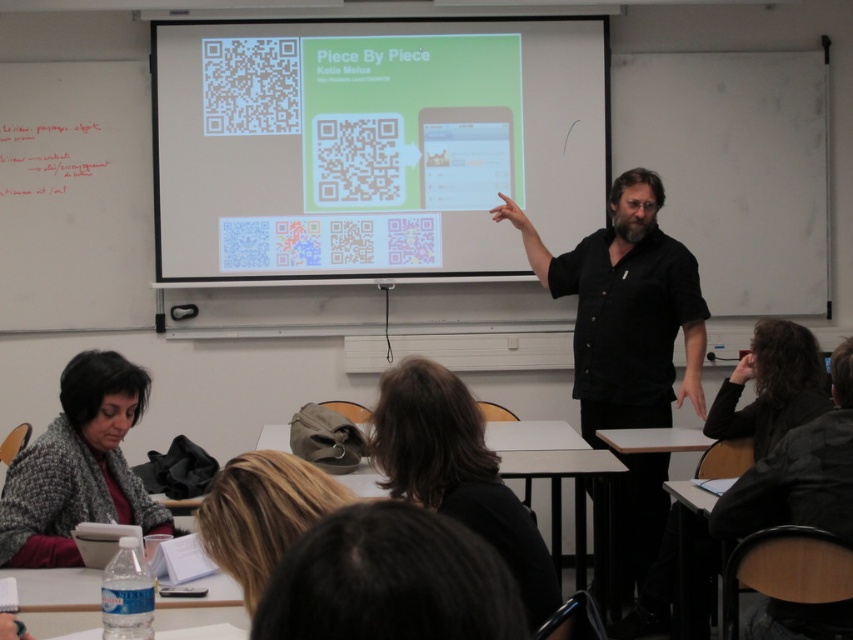
Question: Can you confirm if white matte qr code at upper center is bigger than black matte shirt at center?

Choices:
 (A) no
 (B) yes

Answer: (A)

Question: In this image, where is white matte qr code at upper center located relative to knitted gray sweater at lower left?

Choices:
 (A) below
 (B) above

Answer: (B)

Question: Is white matte qr code at upper center above knitted gray sweater at lower left?

Choices:
 (A) no
 (B) yes

Answer: (B)

Question: Estimate the real-world distances between objects in this image. Which object is closer to the white matte qr code at upper center?

Choices:
 (A) knitted gray sweater at lower left
 (B) black matte shirt at center

Answer: (B)

Question: Which of these objects is positioned closest to the black matte shirt at center?

Choices:
 (A) knitted gray sweater at lower left
 (B) white matte qr code at upper center

Answer: (B)

Question: Among these points, which one is farthest from the camera?

Choices:
 (A) (653, 237)
 (B) (409, 236)
 (C) (67, 452)

Answer: (B)